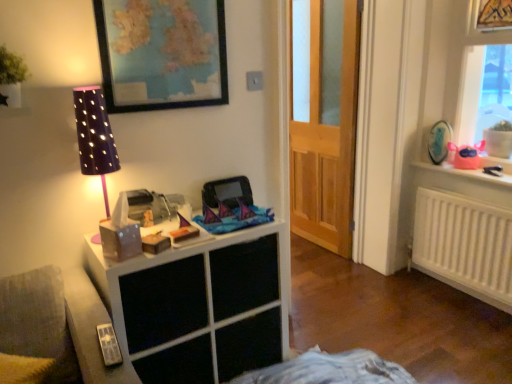
In order to click on space that is in front of white matte radiator at right in this screenshot , I will do `click(466, 332)`.